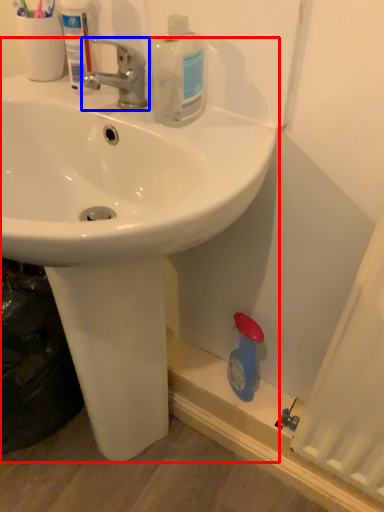
Question: Which object appears farthest to the camera in this image, sink (highlighted by a red box) or tap (highlighted by a blue box)?

Choices:
 (A) sink
 (B) tap

Answer: (B)